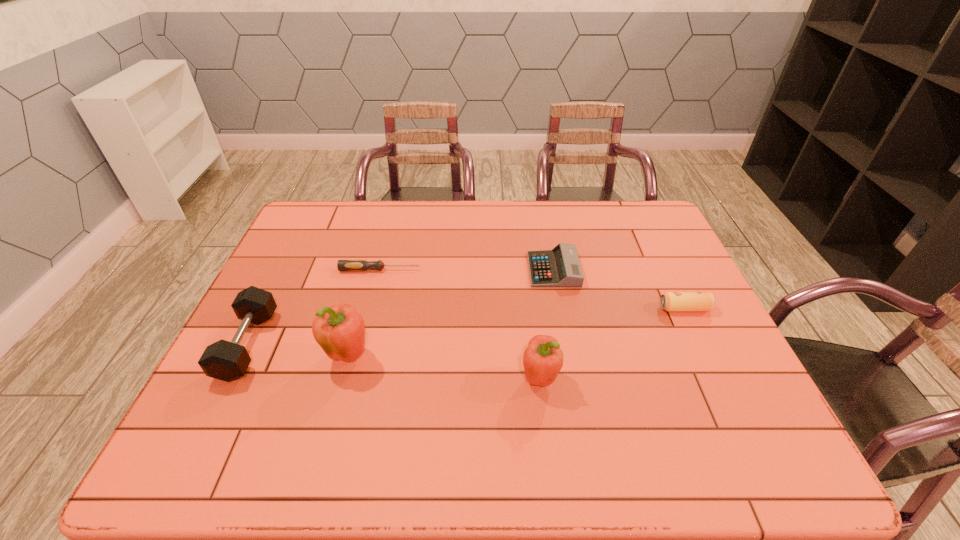
Find the location of a particular element. This screenshot has height=540, width=960. the left pepper is located at coordinates (340, 330).

Image resolution: width=960 pixels, height=540 pixels. I want to click on the taller pepper, so tap(340, 330).

Where is `the shorter pepper`? This screenshot has width=960, height=540. the shorter pepper is located at coordinates pyautogui.click(x=543, y=359).

I want to click on the second tallest object, so tap(543, 359).

Where is `screwdriver`? screwdriver is located at coordinates (343, 265).

Locate an element on the screen. The width and height of the screenshot is (960, 540). calculator is located at coordinates (560, 267).

Find the location of a particular element. the fourth shortest object is located at coordinates (227, 361).

Find the location of a particular element. Image resolution: width=960 pixels, height=540 pixels. dumbbell is located at coordinates (227, 361).

Locate an element on the screen. The image size is (960, 540). the fourth tallest object is located at coordinates (670, 301).

The width and height of the screenshot is (960, 540). What are the coordinates of `beer can` in the screenshot? It's located at point(670,301).